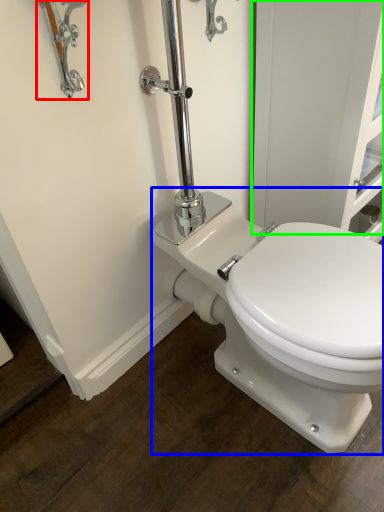
Question: Based on their relative distances, which object is nearer to faucet (highlighted by a red box)? Choose from toilet (highlighted by a blue box) and screen door (highlighted by a green box).

Choices:
 (A) toilet
 (B) screen door

Answer: (B)